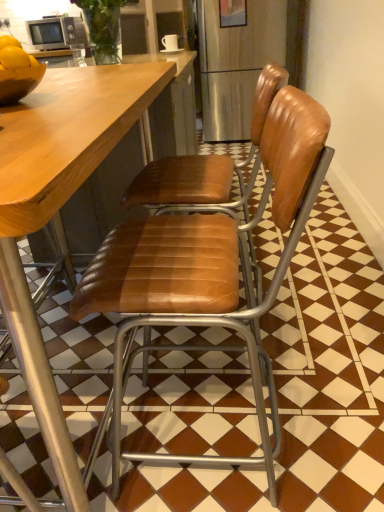
Question: In which direction should I rotate to look at brown leather chair at center, which ranks as the 1th chair in front-to-back order?

Choices:
 (A) left
 (B) right

Answer: (B)

Question: Considering the relative sizes of shiny brown bowl at left and white glossy mug at upper center in the image provided, is shiny brown bowl at left smaller than white glossy mug at upper center?

Choices:
 (A) no
 (B) yes

Answer: (A)

Question: Can you confirm if shiny brown bowl at left is bigger than white glossy mug at upper center?

Choices:
 (A) yes
 (B) no

Answer: (A)

Question: Is shiny brown bowl at left looking in the opposite direction of white glossy mug at upper center?

Choices:
 (A) yes
 (B) no

Answer: (B)

Question: Does shiny brown bowl at left come behind white glossy mug at upper center?

Choices:
 (A) no
 (B) yes

Answer: (A)

Question: Can you confirm if shiny brown bowl at left is wider than white glossy mug at upper center?

Choices:
 (A) no
 (B) yes

Answer: (B)

Question: From the image's perspective, would you say shiny brown bowl at left is shown under white glossy mug at upper center?

Choices:
 (A) no
 (B) yes

Answer: (B)

Question: Could you tell me if brown leather chair at center, the 1th chair from the back, is facing white glossy mug at upper center?

Choices:
 (A) no
 (B) yes

Answer: (A)

Question: Is brown leather chair at center, acting as the second chair starting from the front, outside of white glossy mug at upper center?

Choices:
 (A) yes
 (B) no

Answer: (A)

Question: From the image's perspective, is brown leather chair at center, acting as the second chair starting from the front, on white glossy mug at upper center?

Choices:
 (A) yes
 (B) no

Answer: (B)

Question: Is brown leather chair at center, the 1th chair from the back, turned away from white glossy mug at upper center?

Choices:
 (A) no
 (B) yes

Answer: (A)

Question: Is the surface of brown leather chair at center, acting as the second chair starting from the front, in direct contact with white glossy mug at upper center?

Choices:
 (A) no
 (B) yes

Answer: (A)

Question: Considering the relative sizes of brown leather chair at center, acting as the second chair starting from the front, and white glossy mug at upper center in the image provided, is brown leather chair at center, acting as the second chair starting from the front, wider than white glossy mug at upper center?

Choices:
 (A) yes
 (B) no

Answer: (A)

Question: Can you confirm if shiny brown bowl at left is shorter than brown leather chair at center, the 1th chair from the back?

Choices:
 (A) yes
 (B) no

Answer: (A)